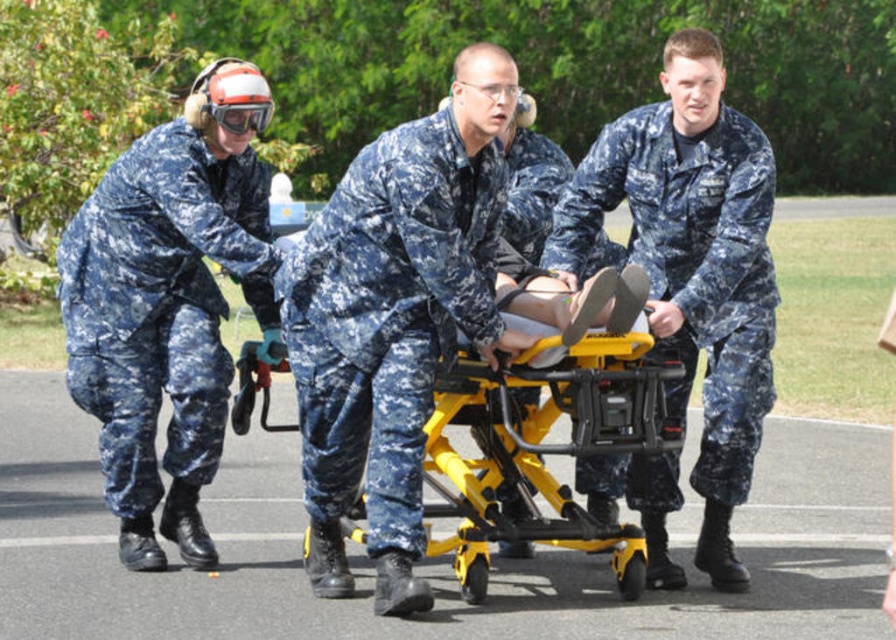
Which is more to the right, camouflage uniform at left or yellow metallic stretcher at center?

Positioned to the right is yellow metallic stretcher at center.

How much distance is there between camouflage uniform at left and yellow metallic stretcher at center?

A distance of 4.86 feet exists between camouflage uniform at left and yellow metallic stretcher at center.

At what (x,y) coordinates should I click in order to perform the action: click on camouflage uniform at left. Please return your answer as a coordinate pair (x, y). This screenshot has height=640, width=896. Looking at the image, I should click on (168, 304).

In order to click on camouflage uniform at left in this screenshot , I will do `click(168, 304)`.

Is camouflage uniform at center below camouflage fabric uniform at center?

Correct, camouflage uniform at center is located below camouflage fabric uniform at center.

Does point (293, 372) come closer to viewer compared to point (698, 298)?

Yes, it is in front of point (698, 298).

Between point (368, 476) and point (754, 355), which one is positioned behind?

The point (754, 355) is behind.

At what (x,y) coordinates should I click in order to perform the action: click on camouflage uniform at center. Please return your answer as a coordinate pair (x, y). Looking at the image, I should click on (394, 320).

Is camouflage uniform at center thinner than yellow metallic stretcher at center?

Yes.

Between camouflage uniform at center and yellow metallic stretcher at center, which one appears on the left side from the viewer's perspective?

From the viewer's perspective, camouflage uniform at center appears more on the left side.

Between point (410, 508) and point (539, 372), which one is positioned in front?

Point (410, 508) is in front.

Find the location of a particular element. camouflage uniform at center is located at coordinates (394, 320).